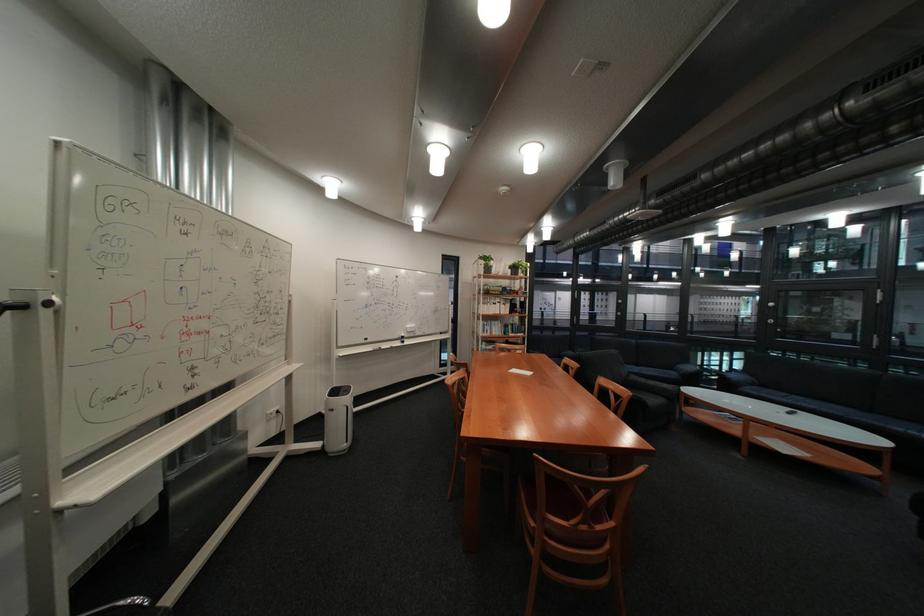
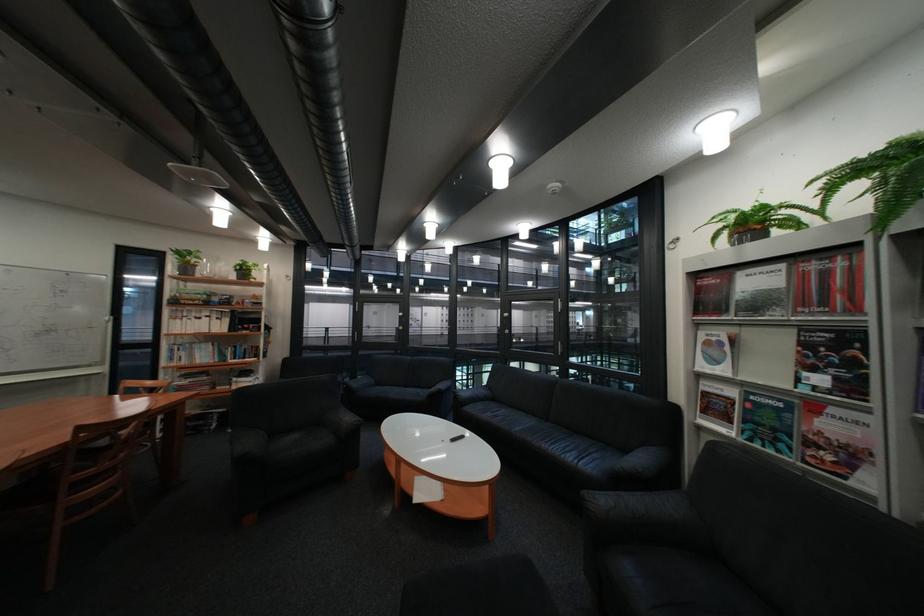
Question: Which direction would the cameraman need to move to produce the second image? Reply with the corresponding letter.

Choices:
 (A) Left
 (B) Right
 (C) Forward
 (D) Backward

Answer: (B)